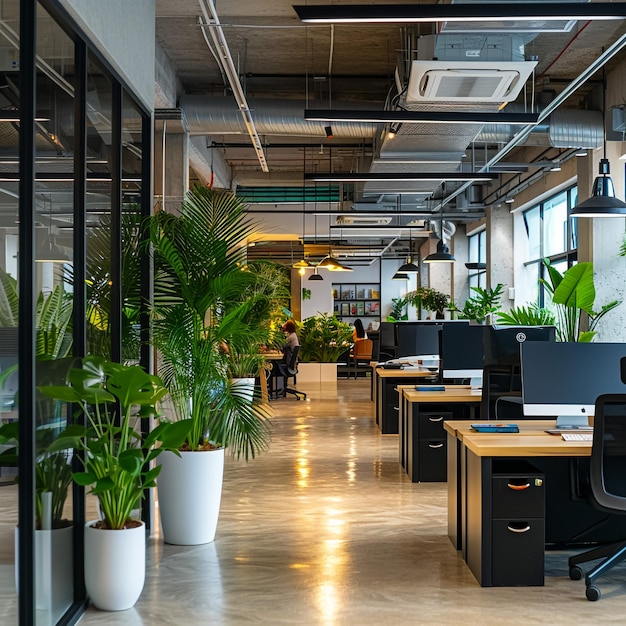
Find the location of a particular element. This screenshot has height=626, width=626. wooden desk top is located at coordinates (536, 447), (452, 394), (392, 372).